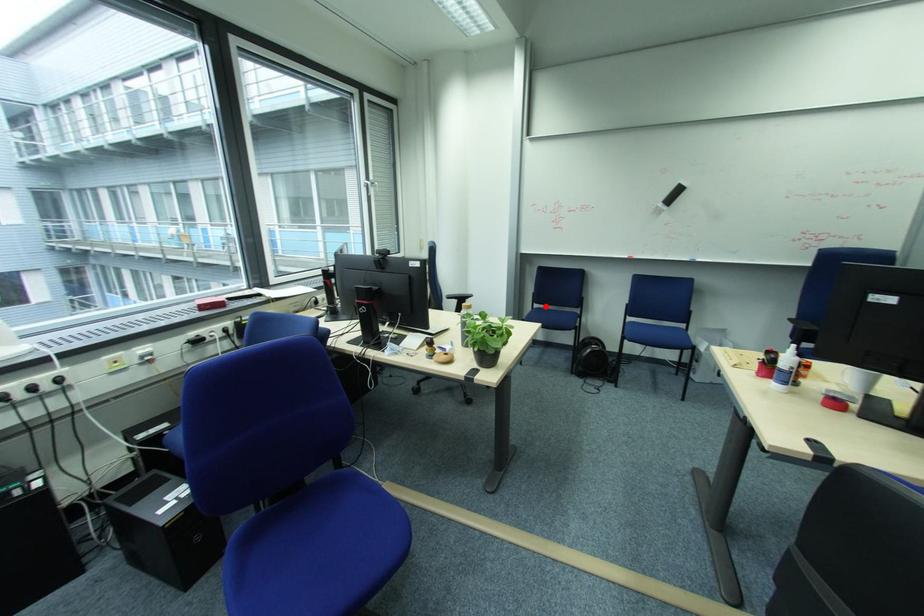
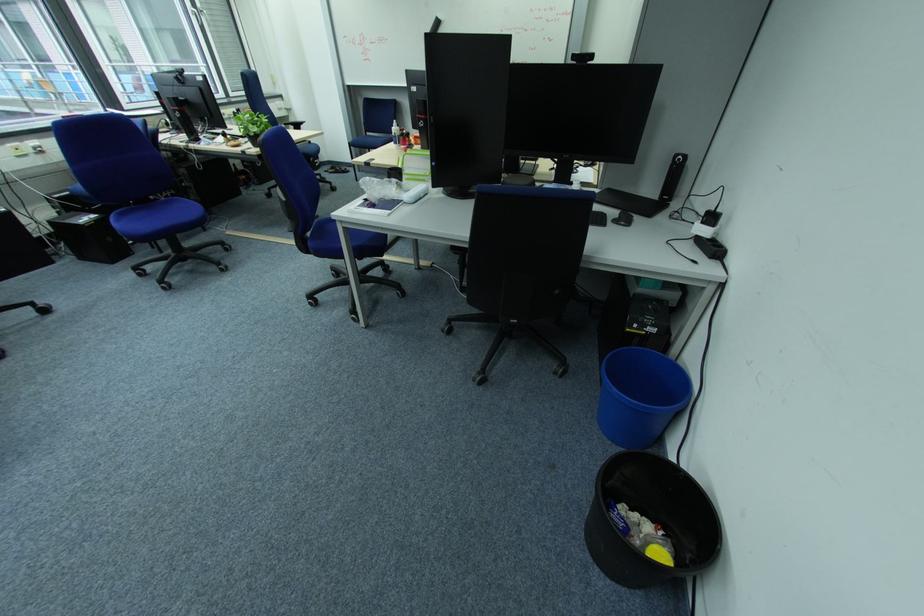
Question: A red point is marked in image1. In image2, is the corresponding 3D point closer to the camera or farther? Reply with the corresponding letter.

Choices:
 (A) The corresponding 3D point is closer.
 (B) The corresponding 3D point is farther.

Answer: (B)